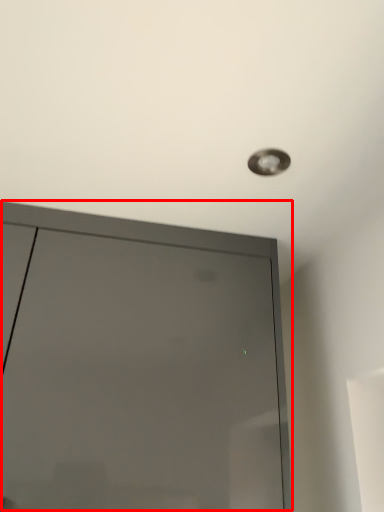
Question: In this image, where is door (annotated by the red box) located relative to droplight?

Choices:
 (A) left
 (B) right

Answer: (A)